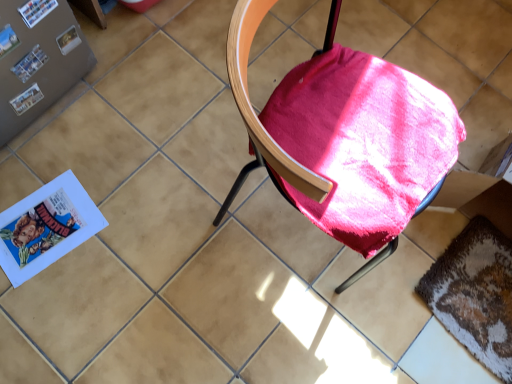
Question: Does matte paper paperback book at upper left, which is the 1th paperback book in top-to-bottom order, have a lesser height compared to velvet-like pink cushion at center?

Choices:
 (A) yes
 (B) no

Answer: (A)

Question: Can you confirm if matte paper paperback book at upper left, which is the 1th paperback book in top-to-bottom order, is wider than velvet-like pink cushion at center?

Choices:
 (A) yes
 (B) no

Answer: (B)

Question: Is matte paper paperback book at upper left, which is the 1th paperback book in top-to-bottom order, far away from velvet-like pink cushion at center?

Choices:
 (A) yes
 (B) no

Answer: (B)

Question: From a real-world perspective, is matte paper paperback book at upper left, which is the 1th paperback book in top-to-bottom order, under velvet-like pink cushion at center?

Choices:
 (A) no
 (B) yes

Answer: (B)

Question: Does matte paper paperback book at upper left, acting as the 1th paperback book starting from the front, come behind velvet-like pink cushion at center?

Choices:
 (A) no
 (B) yes

Answer: (B)

Question: From the image's perspective, relative to velvet-like pink cushion at center, is matte plastic paperback book at upper left, the 2th paperback book in the top-to-bottom sequence, above or below?

Choices:
 (A) below
 (B) above

Answer: (B)

Question: Considering the positions of matte plastic paperback book at upper left, the 2th paperback book in the top-to-bottom sequence, and velvet-like pink cushion at center in the image, is matte plastic paperback book at upper left, the 2th paperback book in the top-to-bottom sequence, wider or thinner than velvet-like pink cushion at center?

Choices:
 (A) wide
 (B) thin

Answer: (B)

Question: Do you think matte plastic paperback book at upper left, placed as the first paperback book when sorted from bottom to top, is within velvet-like pink cushion at center, or outside of it?

Choices:
 (A) outside
 (B) inside

Answer: (A)

Question: Considering the positions of matte plastic paperback book at upper left, the 2th paperback book in the top-to-bottom sequence, and velvet-like pink cushion at center in the image, is matte plastic paperback book at upper left, the 2th paperback book in the top-to-bottom sequence, taller or shorter than velvet-like pink cushion at center?

Choices:
 (A) short
 (B) tall

Answer: (A)

Question: Visually, is velvet-like pink cushion at center positioned to the left or to the right of textured brown mat at lower right?

Choices:
 (A) right
 (B) left

Answer: (B)

Question: In terms of width, does velvet-like pink cushion at center look wider or thinner when compared to textured brown mat at lower right?

Choices:
 (A) thin
 (B) wide

Answer: (B)

Question: From the image's perspective, is velvet-like pink cushion at center above or below textured brown mat at lower right?

Choices:
 (A) above
 (B) below

Answer: (A)

Question: Is velvet-like pink cushion at center bigger or smaller than textured brown mat at lower right?

Choices:
 (A) small
 (B) big

Answer: (B)

Question: In terms of height, does velvet-like pink cushion at center look taller or shorter compared to matte plastic paperback book at upper left, acting as the 2th paperback book starting from the front?

Choices:
 (A) short
 (B) tall

Answer: (B)

Question: In the image, is velvet-like pink cushion at center positioned in front of or behind matte plastic paperback book at upper left, the 2th paperback book in the top-to-bottom sequence?

Choices:
 (A) front
 (B) behind

Answer: (A)